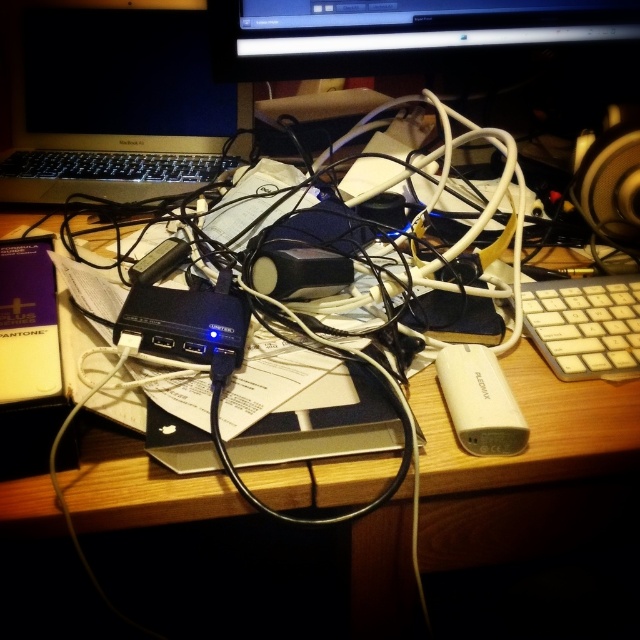
Question: Considering the real-world distances, which object is farthest from the white plastic ipod at lower right?

Choices:
 (A) silver metallic laptop at upper left
 (B) black glossy monitor at upper center
 (C) black fabric speaker at upper right
 (D) white plastic keyboard at right

Answer: (A)

Question: Which point is farther to the camera?

Choices:
 (A) white plastic keyboard at right
 (B) silver metallic laptop at upper left
 (C) black glossy monitor at upper center

Answer: (B)

Question: Does white plastic ipod at lower right appear on the left side of black fabric speaker at upper right?

Choices:
 (A) yes
 (B) no

Answer: (A)

Question: From the image, what is the correct spatial relationship of white plastic keyboard at right in relation to black fabric speaker at upper right?

Choices:
 (A) left
 (B) right

Answer: (A)

Question: Among these points, which one is farthest from the camera?

Choices:
 (A) (x=36, y=106)
 (B) (x=374, y=38)

Answer: (A)

Question: In this image, where is silver metallic laptop at upper left located relative to black glossy monitor at upper center?

Choices:
 (A) right
 (B) left

Answer: (B)